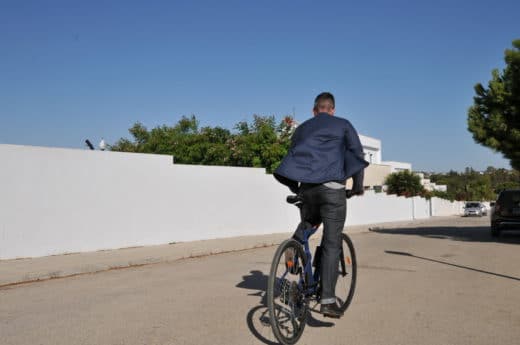
This screenshot has width=520, height=345. In order to click on coat in this screenshot , I will do `click(330, 147)`.